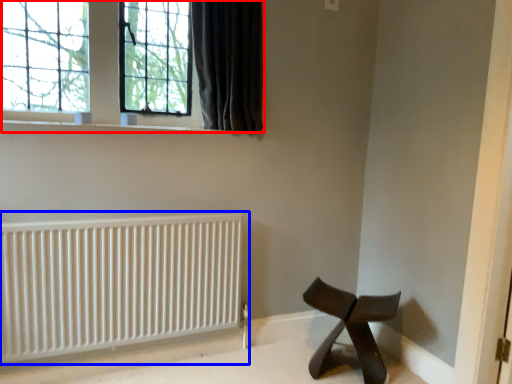
Question: Which object appears farthest to the camera in this image, window (highlighted by a red box) or radiator (highlighted by a blue box)?

Choices:
 (A) window
 (B) radiator

Answer: (A)